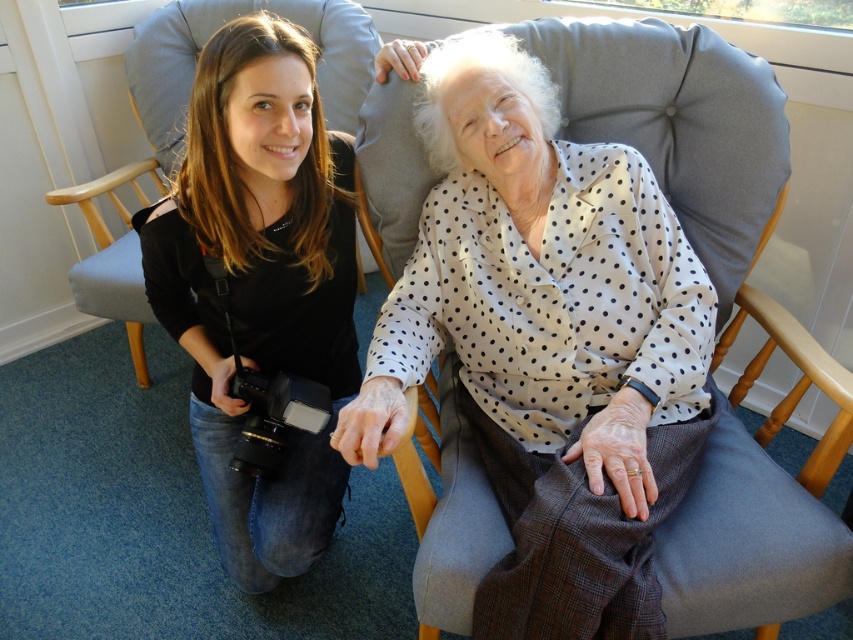
Who is shorter, white dotted shirt at upper center or gray fabric rocking chair at left?

white dotted shirt at upper center

Between point (326, 266) and point (144, 358), which one is positioned behind?

The point (144, 358) is more distant.

Find the location of `white dotted shirt at upper center`. white dotted shirt at upper center is located at coordinates (259, 284).

Locate an element on the screen. This screenshot has width=853, height=640. white dotted shirt at upper center is located at coordinates (259, 284).

Can you confirm if white dotted shirt at center is wider than gray fabric rocking chair at left?

Incorrect, white dotted shirt at center's width does not surpass gray fabric rocking chair at left's.

Based on the photo, who is higher up, white dotted shirt at center or gray fabric rocking chair at left?

gray fabric rocking chair at left

Is point (350, 452) closer to viewer compared to point (303, 10)?

Yes, point (350, 452) is closer to viewer.

In order to click on white dotted shirt at center in this screenshot , I will do `click(540, 292)`.

Can you confirm if white dotted shirt at center is positioned above white dotted shirt at upper center?

Indeed, white dotted shirt at center is positioned over white dotted shirt at upper center.

Is white dotted shirt at center closer to camera compared to white dotted shirt at upper center?

Yes.

Between point (498, 44) and point (289, 250), which one is positioned in front?

Point (498, 44) is more forward.

The height and width of the screenshot is (640, 853). In order to click on white dotted shirt at center in this screenshot , I will do `click(540, 292)`.